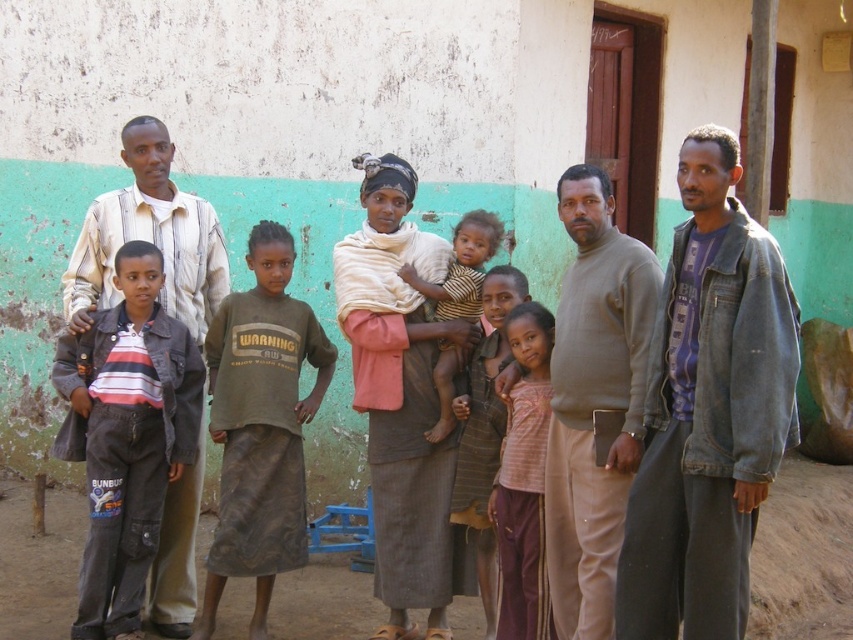
Question: Among these points, which one is farthest from the camera?

Choices:
 (A) (395, 637)
 (B) (149, 432)
 (C) (256, 310)
 (D) (523, 573)

Answer: (C)

Question: Among these objects, which one is farthest from the camera?

Choices:
 (A) dark green cotton shirt at center
 (B) matte gray jacket at center

Answer: (A)

Question: Is pink fabric at center thinner than striped cotton shirt at center?

Choices:
 (A) no
 (B) yes

Answer: (B)

Question: Which of the following is the closest to the observer?

Choices:
 (A) matte gray sweater at center
 (B) pink striped shirt at center
 (C) dark green cotton shirt at center

Answer: (A)

Question: Is matte gray sweater at center below striped cotton shirt at center?

Choices:
 (A) yes
 (B) no

Answer: (A)

Question: Does matte gray jacket at center appear on the right side of pink striped shirt at center?

Choices:
 (A) yes
 (B) no

Answer: (A)